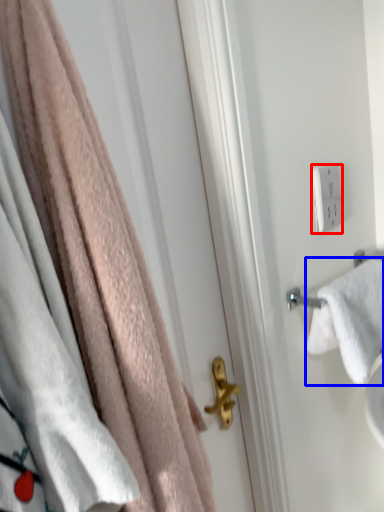
Question: Which object is further to the camera taking this photo, light switch (highlighted by a red box) or towel (highlighted by a blue box)?

Choices:
 (A) light switch
 (B) towel

Answer: (A)